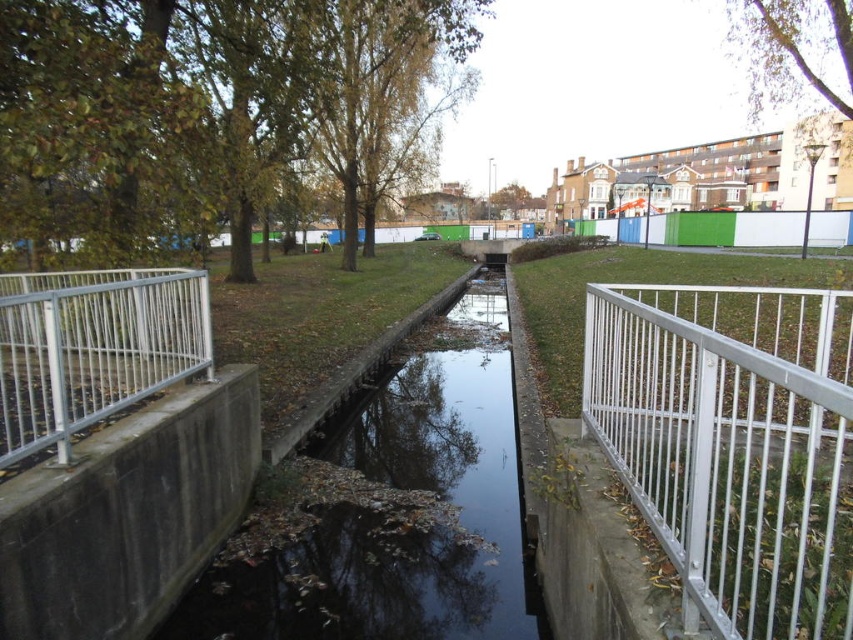
Question: Which of these objects is positioned closest to the green fabric fence at center?

Choices:
 (A) silver metallic fence at left
 (B) white metal fence at right

Answer: (B)

Question: Is black concrete stream at center behind silver metallic fence at left?

Choices:
 (A) no
 (B) yes

Answer: (B)

Question: Can you confirm if black concrete stream at center is bigger than green fabric fence at center?

Choices:
 (A) yes
 (B) no

Answer: (B)

Question: Can you confirm if black concrete stream at center is bigger than silver metallic fence at left?

Choices:
 (A) no
 (B) yes

Answer: (B)

Question: Estimate the real-world distances between objects in this image. Which object is farther from the white metal fence at right?

Choices:
 (A) green fabric fence at center
 (B) silver metallic fence at left
 (C) black concrete stream at center

Answer: (A)

Question: Which object appears closest to the camera in this image?

Choices:
 (A) black concrete stream at center
 (B) silver metallic fence at left
 (C) green fabric fence at center

Answer: (B)